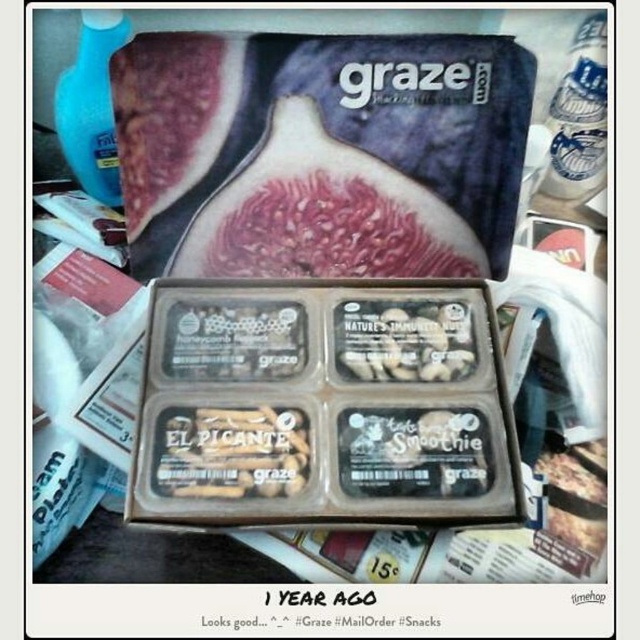
Between point (294, 208) and point (422, 332), which one is positioned in front?

Positioned in front is point (294, 208).

Does point (432, 209) come in front of point (468, 371)?

No, (432, 209) is behind (468, 371).

Image resolution: width=640 pixels, height=640 pixels. In order to click on fuzzy red fig at center in this screenshot , I will do `click(323, 212)`.

Does brown matte snack bar at center appear over white matte nuts at center?

Actually, brown matte snack bar at center is below white matte nuts at center.

Which of these two, brown matte snack bar at center or white matte nuts at center, stands shorter?

brown matte snack bar at center is shorter.

Between point (188, 424) and point (365, 358), which one is positioned in front?

Point (188, 424)

You are a GUI agent. You are given a task and a screenshot of the screen. Output one action in this format:
    pyautogui.click(x=<x>, y=<y>)
    Task: Click on the brown matte snack bar at center
    
    Given the screenshot: What is the action you would take?
    [230, 451]

Is fuzzy red fig at center shorter than brown matte snack bar at center?

No.

Does fuzzy red fig at center appear on the right side of brown matte snack bar at center?

Yes, fuzzy red fig at center is to the right of brown matte snack bar at center.

Who is more forward, (x=180, y=273) or (x=228, y=410)?

Positioned in front is point (x=228, y=410).

Where is `fuzzy red fig at center`? Image resolution: width=640 pixels, height=640 pixels. fuzzy red fig at center is located at coordinates (323, 212).